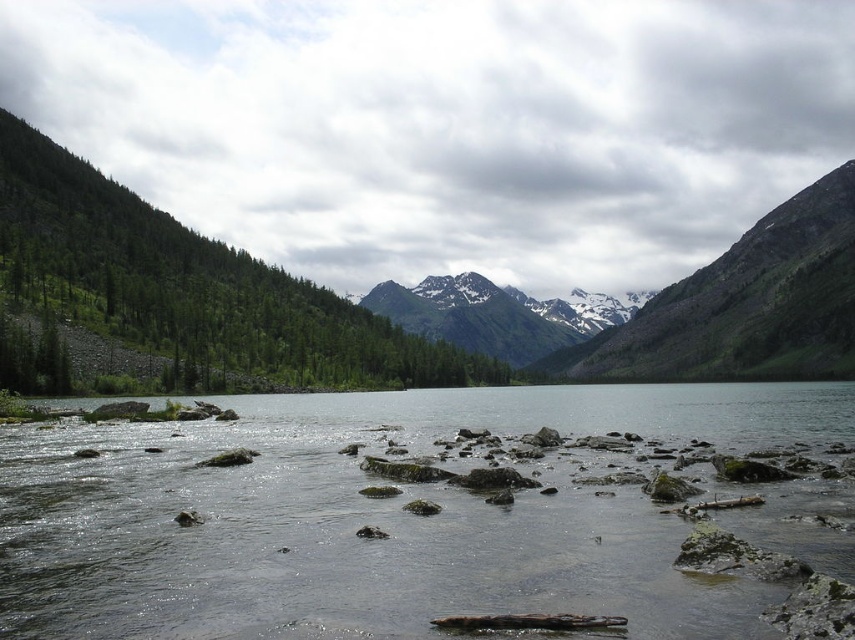
You are standing at the edge of the lake and want to take a photo of the clear water at center and the green matte tree at left. Which object appears taller in the photo?

The green matte tree at left appears taller than the clear water at center in the photo.

You are standing at the point with coordinates point (606,604) and want to walk towards the point with coordinates point (270,289). Given the terrain described in the scene, will you have to climb uphill or downhill?

Since point (606,604) is in front of point (270,289), you will be moving towards a lower elevation, so you will have to climb downhill.

You are a hiker standing at the edge of the lake and see the green matte tree at left and the snowy granite mountain at center. Which object is closer to you?

The green matte tree at left is closer to you because it is in front of the snowy granite mountain at center.